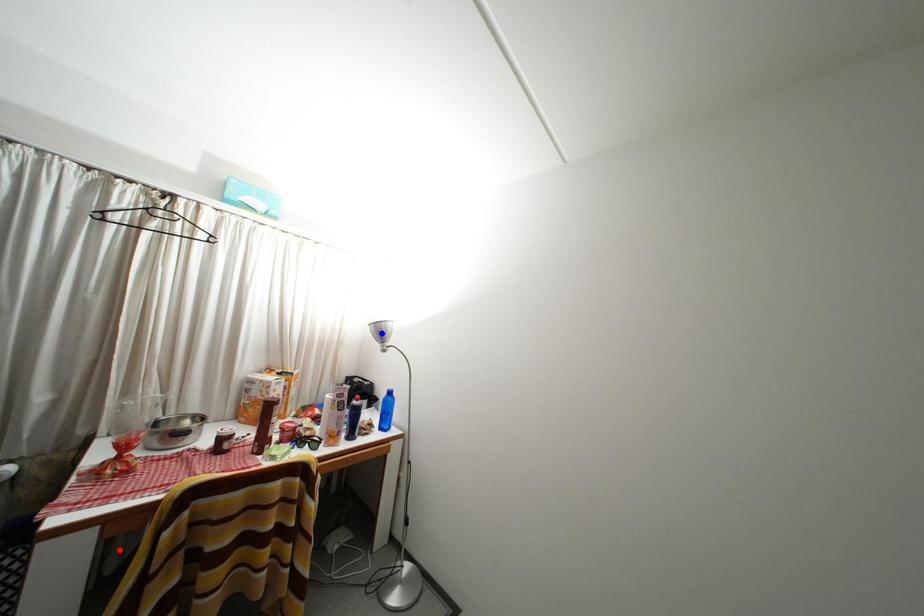
Question: Which of the two points in the image is closer to the camera?

Choices:
 (A) Blue point is closer.
 (B) Red point is closer.

Answer: (B)